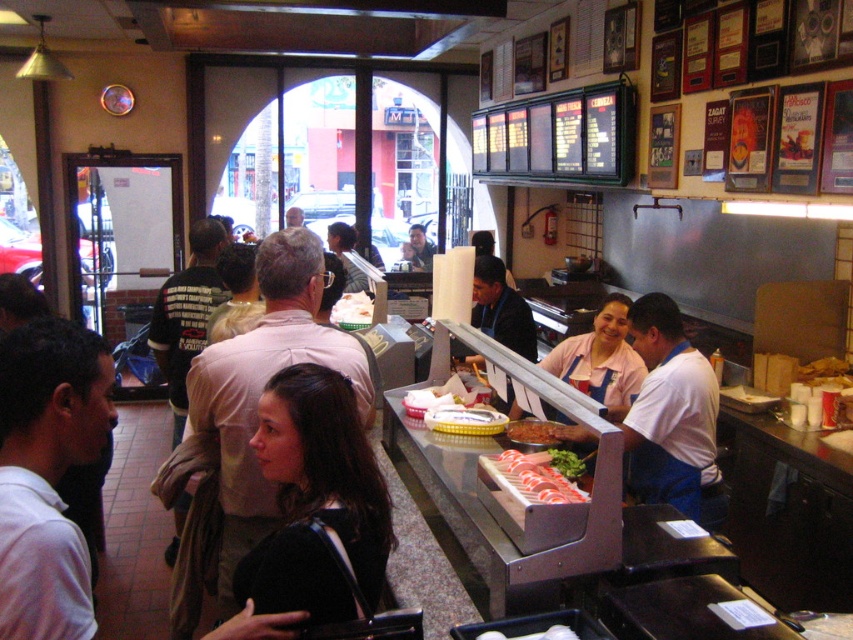
Question: Does black fabric shirt at center lie behind white paper bag at center?

Choices:
 (A) no
 (B) yes

Answer: (A)

Question: Based on their relative distances, which object is nearer to the slightly browned bread at counter?

Choices:
 (A) sliced raw fish at counter
 (B) white paper bag at center
 (C) black fabric shirt at center

Answer: (A)

Question: Is black fabric shirt at center below sliced raw fish at counter?

Choices:
 (A) yes
 (B) no

Answer: (B)

Question: Which of the following is the farthest from the observer?

Choices:
 (A) (339, 317)
 (B) (546, 454)
 (C) (277, 536)

Answer: (A)

Question: Which point is farther to the camera?

Choices:
 (A) (347, 321)
 (B) (519, 467)
 (C) (265, 609)
 (D) (509, 429)

Answer: (A)

Question: Does black fabric shirt at center appear on the right side of slightly browned bread at counter?

Choices:
 (A) no
 (B) yes

Answer: (A)